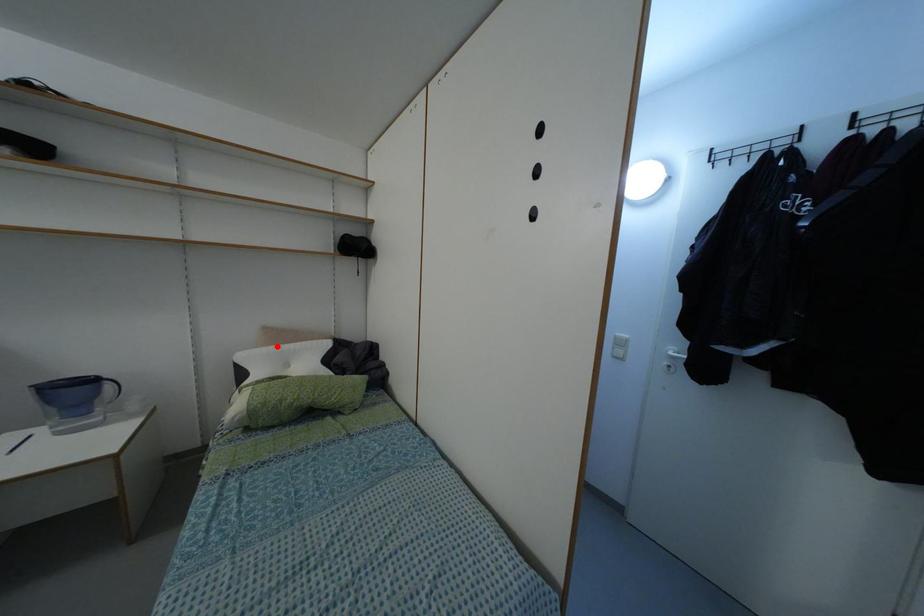
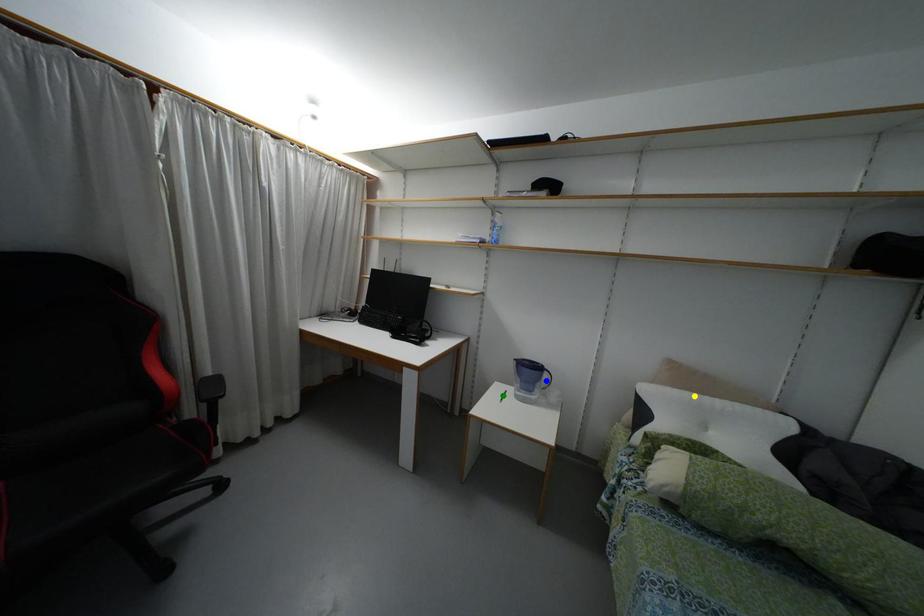
Question: I am providing you with two images of the same scene from different viewpoints. A red point is marked on the first image. You are given multiple points on the second image. Can you choose the point in image 2 that corresponds to the point in image 1?

Choices:
 (A) blue point
 (B) yellow point
 (C) green point

Answer: (B)